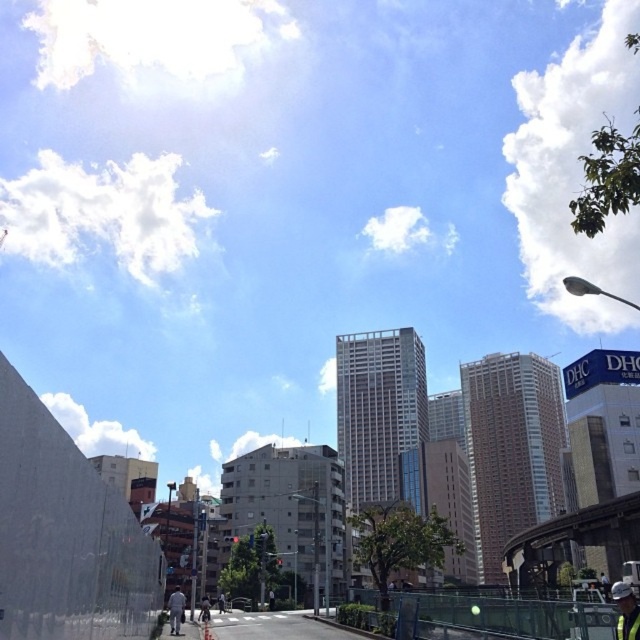
Does point (621, 605) come closer to viewer compared to point (177, 632)?

Yes.

Between hard hat at center and white fabric man at lower center, which one is positioned lower?

white fabric man at lower center is lower down.

Find the location of a particular element. Image resolution: width=640 pixels, height=640 pixels. hard hat at center is located at coordinates (625, 611).